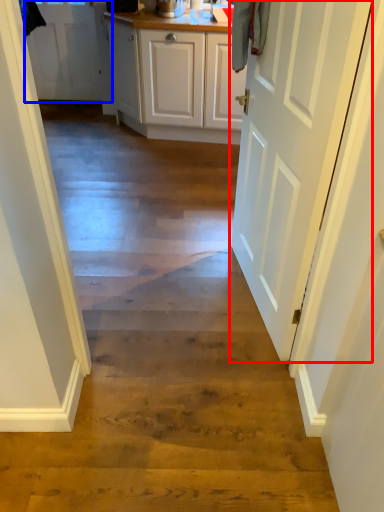
Question: Which object appears farthest to the camera in this image, door (highlighted by a red box) or door (highlighted by a blue box)?

Choices:
 (A) door
 (B) door

Answer: (B)